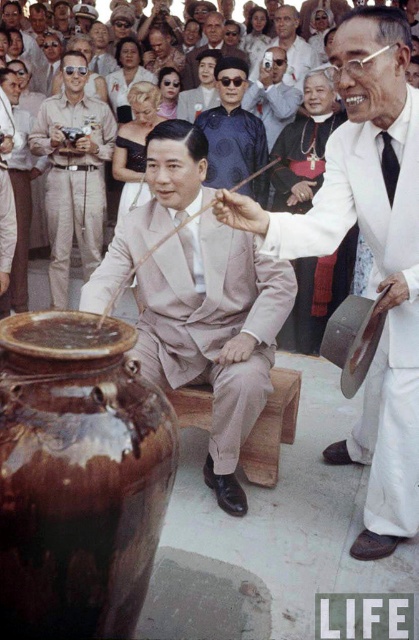
You are a photographer at the event and need to capture a photo where both the white matte suit at center and the matte beige suit at center are visible. Based on their heights, which one will appear larger in the photo?

The white matte suit at center is much taller than the matte beige suit at center, so it will appear larger in the photo.